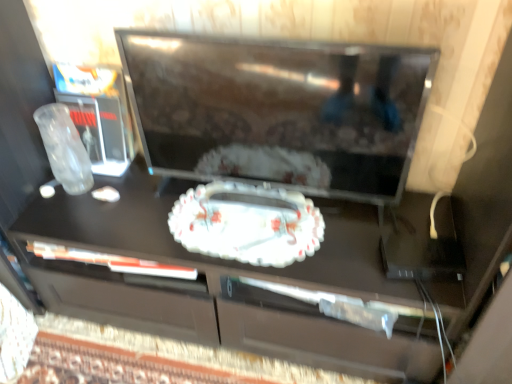
Question: Is matte black tv at center positioned behind porcelain floral tray at center?

Choices:
 (A) no
 (B) yes

Answer: (A)

Question: Is matte black tv at center bigger than porcelain floral tray at center?

Choices:
 (A) yes
 (B) no

Answer: (A)

Question: Is porcelain floral tray at center completely or partially inside matte black tv at center?

Choices:
 (A) no
 (B) yes

Answer: (B)

Question: Is matte black tv at center oriented towards porcelain floral tray at center?

Choices:
 (A) yes
 (B) no

Answer: (A)

Question: Is matte black tv at center facing away from porcelain floral tray at center?

Choices:
 (A) yes
 (B) no

Answer: (B)

Question: Is matte black tv at center to the left of porcelain floral tray at center from the viewer's perspective?

Choices:
 (A) no
 (B) yes

Answer: (A)

Question: Does porcelain floral tray at center come behind matte black tv at center?

Choices:
 (A) yes
 (B) no

Answer: (A)

Question: From the image's perspective, is porcelain floral tray at center on matte black tv at center?

Choices:
 (A) yes
 (B) no

Answer: (B)

Question: Considering the relative positions of porcelain floral tray at center and matte black tv at center in the image provided, is porcelain floral tray at center to the left of matte black tv at center from the viewer's perspective?

Choices:
 (A) yes
 (B) no

Answer: (A)

Question: Does porcelain floral tray at center have a smaller size compared to matte black tv at center?

Choices:
 (A) no
 (B) yes

Answer: (B)

Question: Are porcelain floral tray at center and matte black tv at center located far from each other?

Choices:
 (A) yes
 (B) no

Answer: (B)

Question: From a real-world perspective, is porcelain floral tray at center positioned under matte black tv at center based on gravity?

Choices:
 (A) yes
 (B) no

Answer: (A)

Question: From the image's perspective, is porcelain floral tray at center located above or below matte black tv at center?

Choices:
 (A) above
 (B) below

Answer: (B)